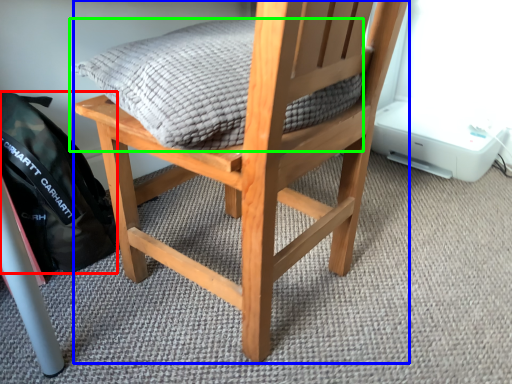
Question: Which object is the closest to the backpack (highlighted by a red box)? Choose among these: chair (highlighted by a blue box) or pillow (highlighted by a green box).

Choices:
 (A) chair
 (B) pillow

Answer: (A)